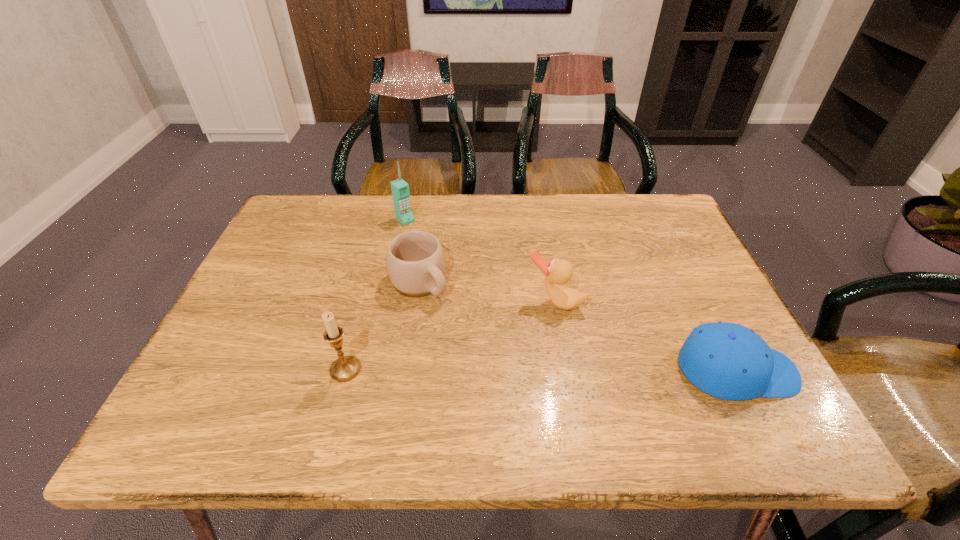
Locate an element on the screen. Image resolution: width=960 pixels, height=540 pixels. vacant space located on the keypad of the farthest object is located at coordinates (454, 267).

Locate an element on the screen. free point located on the keypad of the farthest object is located at coordinates (438, 251).

You are a GUI agent. You are given a task and a screenshot of the screen. Output one action in this format:
    pyautogui.click(x=<x>, y=<y>)
    Task: Click on the vacant position located on the side of the mug with the handle
    This screenshot has width=960, height=540.
    Given the screenshot: What is the action you would take?
    pyautogui.click(x=449, y=311)

Where is `vacant region located on the side of the mug with the handle`? This screenshot has height=540, width=960. vacant region located on the side of the mug with the handle is located at coordinates (483, 341).

Identify the location of vacant space located on the side of the mug with the handle. (512, 367).

Image resolution: width=960 pixels, height=540 pixels. In order to click on object that is at the far edge in this screenshot , I will do `click(400, 189)`.

This screenshot has height=540, width=960. What are the coordinates of `candle holder situated at the near edge` in the screenshot? It's located at (345, 368).

This screenshot has height=540, width=960. Identify the location of cap that is at the near edge. (729, 361).

Where is `object present at the right edge`? This screenshot has height=540, width=960. object present at the right edge is located at coordinates (729, 361).

Where is `object located at the near right corner`? The height and width of the screenshot is (540, 960). object located at the near right corner is located at coordinates (729, 361).